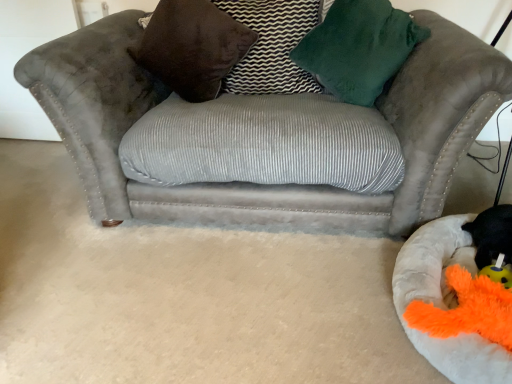
Question: From a real-world perspective, is fluffy white dog bed at lower right located higher than suede gray couch at center?

Choices:
 (A) no
 (B) yes

Answer: (A)

Question: From the image's perspective, is fluffy white dog bed at lower right on suede gray couch at center?

Choices:
 (A) no
 (B) yes

Answer: (A)

Question: Considering the relative sizes of fluffy white dog bed at lower right and suede gray couch at center in the image provided, is fluffy white dog bed at lower right taller than suede gray couch at center?

Choices:
 (A) no
 (B) yes

Answer: (A)

Question: Is fluffy white dog bed at lower right next to suede gray couch at center and touching it?

Choices:
 (A) no
 (B) yes

Answer: (A)

Question: Can you confirm if fluffy white dog bed at lower right is bigger than suede gray couch at center?

Choices:
 (A) no
 (B) yes

Answer: (A)

Question: Considering their positions, is velvet brown pillow at center, acting as the 1th pillow starting from the right, located in front of or behind fluffy white dog bed at lower right?

Choices:
 (A) front
 (B) behind

Answer: (B)

Question: In terms of width, does velvet brown pillow at center, which ranks as the second pillow in left-to-right order, look wider or thinner when compared to fluffy white dog bed at lower right?

Choices:
 (A) wide
 (B) thin

Answer: (B)

Question: In terms of height, does velvet brown pillow at center, acting as the 1th pillow starting from the right, look taller or shorter compared to fluffy white dog bed at lower right?

Choices:
 (A) short
 (B) tall

Answer: (B)

Question: Is point (237, 89) closer or farther from the camera than point (504, 362)?

Choices:
 (A) farther
 (B) closer

Answer: (A)

Question: Considering the positions of velvet brown pillow at upper center, which ranks as the second pillow in right-to-left order, and black plush toy at lower right in the image, is velvet brown pillow at upper center, which ranks as the second pillow in right-to-left order, taller or shorter than black plush toy at lower right?

Choices:
 (A) tall
 (B) short

Answer: (A)

Question: Is velvet brown pillow at upper center, which ranks as the second pillow in right-to-left order, wider or thinner than black plush toy at lower right?

Choices:
 (A) wide
 (B) thin

Answer: (A)

Question: Do you think velvet brown pillow at upper center, the 1th pillow from the left, is within black plush toy at lower right, or outside of it?

Choices:
 (A) outside
 (B) inside

Answer: (A)

Question: From the image's perspective, is velvet brown pillow at upper center, which ranks as the second pillow in right-to-left order, positioned above or below black plush toy at lower right?

Choices:
 (A) above
 (B) below

Answer: (A)

Question: Based on their positions, is fluffy white dog bed at lower right located to the left or right of suede gray couch at center?

Choices:
 (A) left
 (B) right

Answer: (B)

Question: Considering the positions of point (441, 349) and point (59, 82), is point (441, 349) closer or farther from the camera than point (59, 82)?

Choices:
 (A) closer
 (B) farther

Answer: (A)